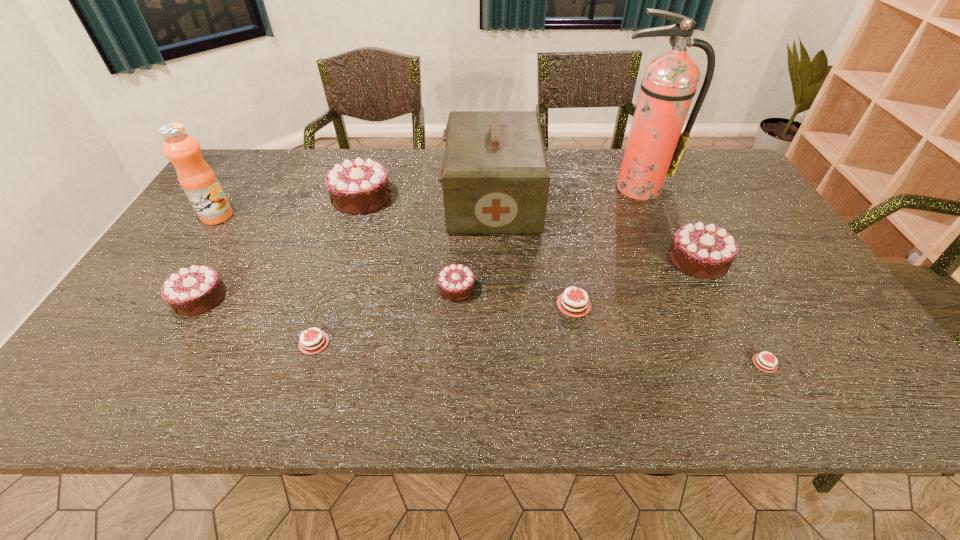
At what (x,y) coordinates should I click in order to perform the action: click on vacant space located on the right of the eighth shortest object. Please return your answer as a coordinate pair (x, y). Looking at the image, I should click on (561, 200).

The width and height of the screenshot is (960, 540). Find the location of `vacant space located on the back of the tallest chocolate cake`. vacant space located on the back of the tallest chocolate cake is located at coordinates (371, 168).

Identify the location of vacant region located on the left of the sixth shortest object. This screenshot has height=540, width=960. (609, 260).

Where is `vacant region located on the left of the leftmost chocolate chocolate cake`? This screenshot has height=540, width=960. vacant region located on the left of the leftmost chocolate chocolate cake is located at coordinates (141, 298).

Find the location of `free point located 0.280m on the back of the seventh tallest object`. free point located 0.280m on the back of the seventh tallest object is located at coordinates (461, 207).

Find the location of a particular element. The width and height of the screenshot is (960, 540). free space located 0.210m on the left of the second red chocolate cake from left to right is located at coordinates (451, 305).

This screenshot has height=540, width=960. I want to click on free space located 0.130m on the back of the second shortest chocolate cake, so click(x=336, y=274).

Locate an element on the screen. vacant point located 0.300m on the left of the shortest chocolate cake is located at coordinates (593, 363).

Identify the location of fire extinguisher that is at the far edge. Image resolution: width=960 pixels, height=540 pixels. (658, 376).

You are a GUI agent. You are given a task and a screenshot of the screen. Output one action in this format:
    pyautogui.click(x=<x>, y=<y>)
    Task: Click on the first-aid kit present at the far edge
    This screenshot has height=540, width=960.
    Given the screenshot: What is the action you would take?
    pyautogui.click(x=658, y=376)